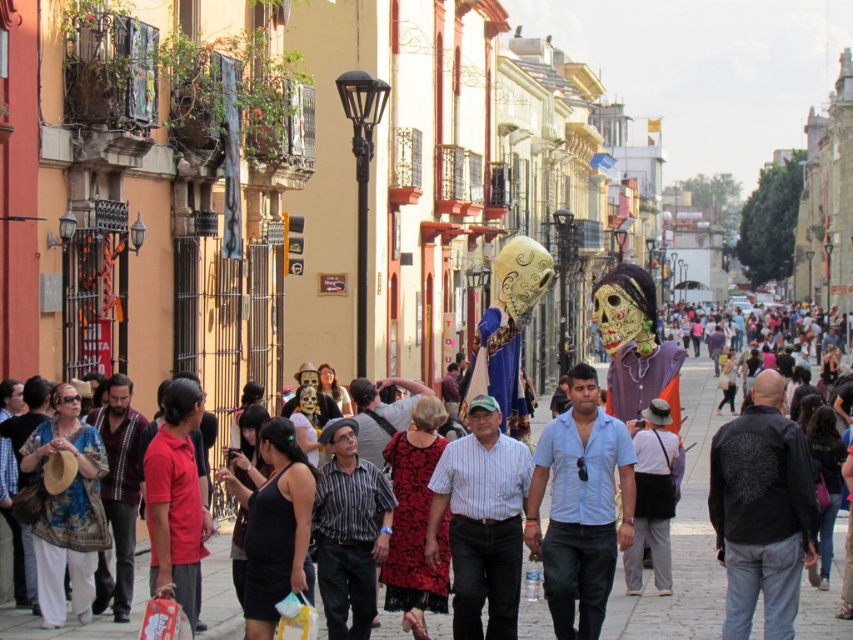
You are standing at the center of the street in the lively scene. There are two points marked on the ground ahead of you. The first point is at coordinates point (590, 406) and the second is at point (849, 417). If you want to reach the point that is closer to you, which one should you walk towards?

You should walk towards point (590, 406) because it is in front of point (849, 417), meaning it is closer to your current position.

You are a fashion designer observing a person dressed in a red matte shirt at center and gray cotton pants at center. Which clothing item would require more fabric to create?

The red matte shirt at center requires more fabric because it is bigger than the gray cotton pants at center.

You are a photographer standing on the street and want to capture both the red floral dress at center and the gray cotton pants at center in your photo. Which clothing item will appear larger in your photo?

The red floral dress at center will appear larger in the photo because it is closer to the viewer than the gray cotton pants at center.